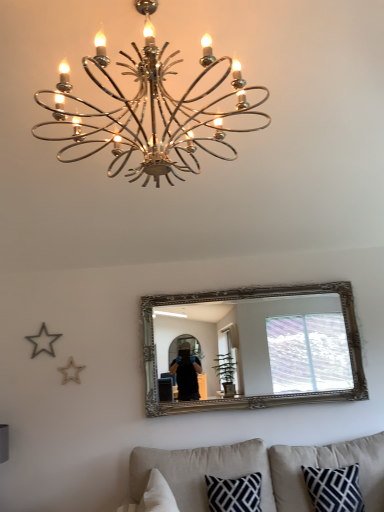
Question: Considering the relative sizes of beige fabric couch at lower center and chrome/metallic chandelier at upper center in the image provided, is beige fabric couch at lower center wider than chrome/metallic chandelier at upper center?

Choices:
 (A) no
 (B) yes

Answer: (B)

Question: Is beige fabric couch at lower center outside of chrome/metallic chandelier at upper center?

Choices:
 (A) no
 (B) yes

Answer: (B)

Question: From a real-world perspective, does beige fabric couch at lower center stand above chrome/metallic chandelier at upper center?

Choices:
 (A) no
 (B) yes

Answer: (A)

Question: Can you confirm if beige fabric couch at lower center is bigger than chrome/metallic chandelier at upper center?

Choices:
 (A) no
 (B) yes

Answer: (B)

Question: From the image's perspective, is beige fabric couch at lower center located above chrome/metallic chandelier at upper center?

Choices:
 (A) no
 (B) yes

Answer: (A)

Question: In terms of height, does navy blue textured pillow at lower right look taller or shorter compared to chrome/metallic chandelier at upper center?

Choices:
 (A) short
 (B) tall

Answer: (A)

Question: From a real-world perspective, is navy blue textured pillow at lower right physically located above or below chrome/metallic chandelier at upper center?

Choices:
 (A) below
 (B) above

Answer: (A)

Question: Is navy blue textured pillow at lower right in front of or behind chrome/metallic chandelier at upper center in the image?

Choices:
 (A) front
 (B) behind

Answer: (B)

Question: Considering the positions of point (349, 456) and point (130, 181), is point (349, 456) closer or farther from the camera than point (130, 181)?

Choices:
 (A) farther
 (B) closer

Answer: (A)

Question: In the image, is navy blue textured pillow at lower right on the left side or the right side of beige fabric couch at lower center?

Choices:
 (A) right
 (B) left

Answer: (A)

Question: Is point (340, 458) closer or farther from the camera than point (289, 466)?

Choices:
 (A) farther
 (B) closer

Answer: (A)

Question: In the image, is navy blue textured pillow at lower right positioned in front of or behind beige fabric couch at lower center?

Choices:
 (A) front
 (B) behind

Answer: (B)

Question: From a real-world perspective, is navy blue textured pillow at lower right positioned above or below beige fabric couch at lower center?

Choices:
 (A) below
 (B) above

Answer: (B)

Question: Would you say beige fabric couch at lower center is to the left or to the right of chrome/metallic chandelier at upper center in the picture?

Choices:
 (A) left
 (B) right

Answer: (B)

Question: Do you think beige fabric couch at lower center is within chrome/metallic chandelier at upper center, or outside of it?

Choices:
 (A) outside
 (B) inside

Answer: (A)